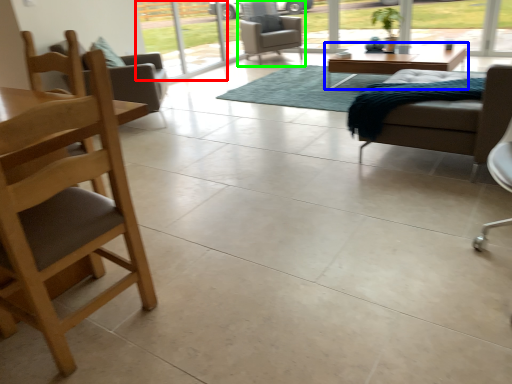
Question: Estimate the real-world distances between objects in this image. Which object is farther from screen door (highlighted by a red box), coffee table (highlighted by a blue box) or chair (highlighted by a green box)?

Choices:
 (A) coffee table
 (B) chair

Answer: (A)